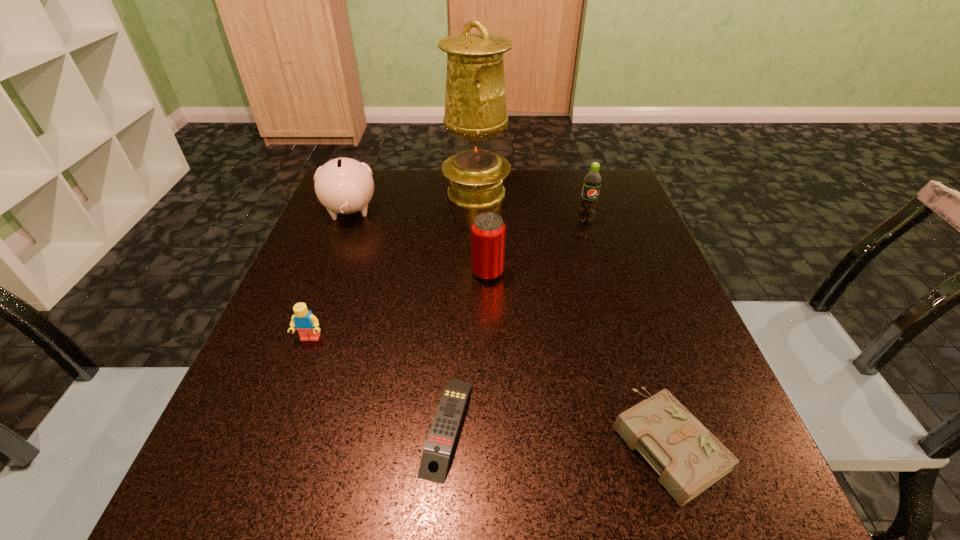
You are a GUI agent. You are given a task and a screenshot of the screen. Output one action in this format:
    pyautogui.click(x=<x>, y=<y>)
    Task: Click on the free spot located on the back of the piggy bank
    The height and width of the screenshot is (540, 960).
    Given the screenshot: What is the action you would take?
    pyautogui.click(x=362, y=181)

This screenshot has height=540, width=960. I want to click on vacant area situated 0.280m on the front of the fourth farthest object, so 491,406.

You are a GUI agent. You are given a task and a screenshot of the screen. Output one action in this format:
    pyautogui.click(x=<x>, y=<y>)
    Task: Click on the vacant region located 0.110m on the front-facing side of the third shortest object
    The width and height of the screenshot is (960, 540).
    Given the screenshot: What is the action you would take?
    pyautogui.click(x=287, y=400)

Image resolution: width=960 pixels, height=540 pixels. I want to click on vacant area situated 0.060m on the left of the sixth tallest object, so click(x=573, y=442).

Locate an element on the screen. This screenshot has height=540, width=960. blank area located 0.130m on the back of the remote control is located at coordinates (454, 320).

The image size is (960, 540). In order to click on oil lamp that is at the far edge in this screenshot , I will do `click(475, 101)`.

Where is `soda at the far edge`? soda at the far edge is located at coordinates (592, 181).

At what (x,y) coordinates should I click in order to perform the action: click on piggy bank located at the far edge. Please return your answer as a coordinate pair (x, y). Looking at the image, I should click on (343, 185).

Where is `diary that is positioned at the near edge`? diary that is positioned at the near edge is located at coordinates (689, 459).

Where is `remote control located at the near edge`? remote control located at the near edge is located at coordinates (439, 445).